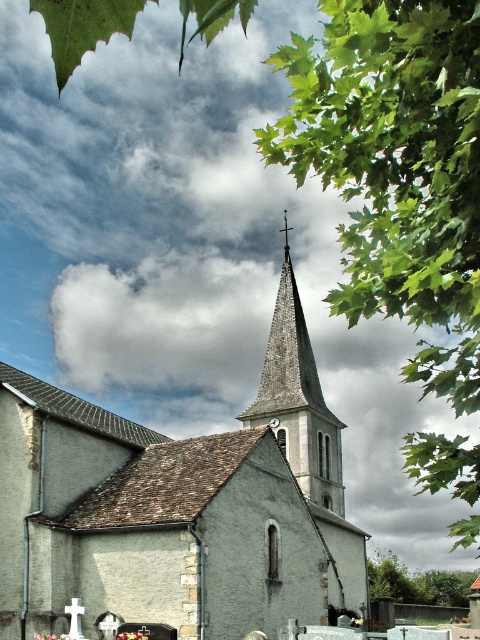
You are an architect analyzing the structure of the gray stone church steeple at center and the gray stone spire at center in the image. Which one of these two structures has a larger size?

The gray stone church steeple at center is bigger than the gray stone spire at center, so the gray stone church steeple at center has a larger size.

You are standing in front of the gray stone church steeple at center and gray stone spire at center. Which one is positioned to the left?

The gray stone church steeple at center is positioned to the left of the gray stone spire at center.